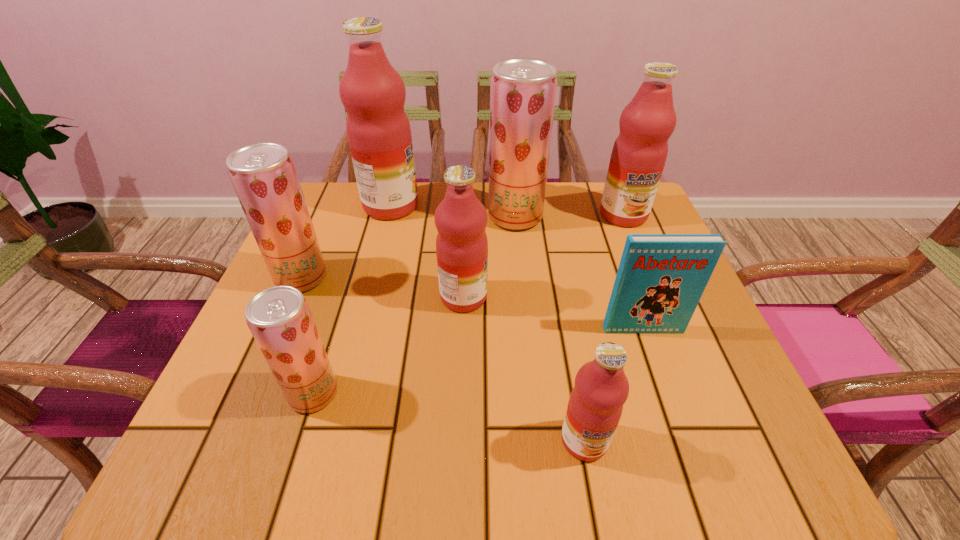
You are a GUI agent. You are given a task and a screenshot of the screen. Output one action in this format:
    pyautogui.click(x=<x>, y=<y>)
    Task: Click on the biggest pink fruit juice
    This screenshot has height=540, width=960.
    Given the screenshot: What is the action you would take?
    pyautogui.click(x=373, y=93)

What are the coordinates of `the tallest object` in the screenshot? It's located at click(373, 93).

Where is `the farthest strawberry fruit juice`? The image size is (960, 540). the farthest strawberry fruit juice is located at coordinates (522, 98).

Identify the location of the rightmost strawberry fruit juice. (522, 98).

Where is `the third smallest pink fruit juice`? The width and height of the screenshot is (960, 540). the third smallest pink fruit juice is located at coordinates (639, 153).

What are the coordinates of `the rightmost fruit juice` in the screenshot? It's located at (639, 153).

The height and width of the screenshot is (540, 960). I want to click on the leftmost fruit juice, so click(x=263, y=175).

The width and height of the screenshot is (960, 540). Find the location of `the leftmost strawberry fruit juice`. the leftmost strawberry fruit juice is located at coordinates (263, 175).

The width and height of the screenshot is (960, 540). I want to click on the second nearest pink fruit juice, so (x=461, y=244).

Locate an element on the screen. This screenshot has width=960, height=540. the fifth object from right to left is located at coordinates (461, 244).